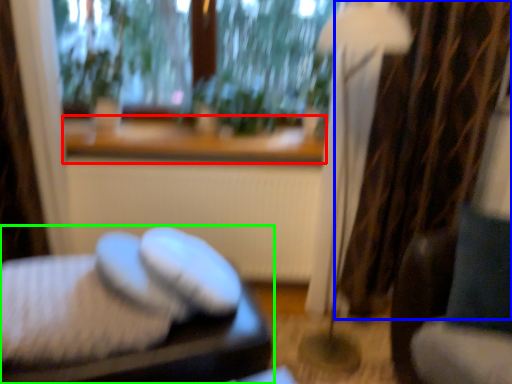
Question: Considering the real-world distances, which object is closest to window sill (highlighted by a red box)? curtain (highlighted by a blue box) or furniture (highlighted by a green box).

Choices:
 (A) curtain
 (B) furniture

Answer: (A)